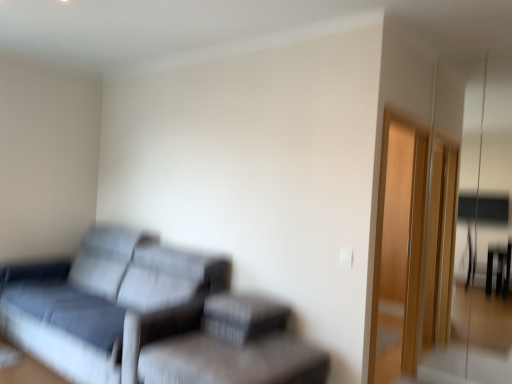
This screenshot has height=384, width=512. I want to click on textured gray swivel chair at lower center, so click(234, 348).

The image size is (512, 384). In order to click on textured fabric footrest at lower center in this screenshot , I will do `click(242, 317)`.

This screenshot has width=512, height=384. Find the location of `transparent glass door at right`. transparent glass door at right is located at coordinates (468, 356).

Which object is closer to the camera taking this photo, transparent glass door at right or textured gray couch at left?

textured gray couch at left is closer to the camera.

This screenshot has height=384, width=512. What are the coordinates of `studio couch below the transparent glass door at right (from the image's perspective)` in the screenshot? It's located at (150, 318).

In the scene shown: From the image's perspective, is transparent glass door at right located above textured gray couch at left?

Yes.

Is point (497, 281) farther from viewer compared to point (266, 356)?

Yes, point (497, 281) is behind point (266, 356).

Is textured fabric footrest at lower center bigger than textured gray couch at left?

No, textured fabric footrest at lower center is not bigger than textured gray couch at left.

How many degrees apart are the facing directions of textured fabric footrest at lower center and textured gray couch at left?

The facing directions of textured fabric footrest at lower center and textured gray couch at left are 0.457 degrees apart.

Which is behind, textured fabric footrest at lower center or textured gray couch at left?

textured fabric footrest at lower center is further from the camera.

Does textured fabric footrest at lower center turn towards textured gray couch at left?

No, textured fabric footrest at lower center is not aimed at textured gray couch at left.

Between textured fabric footrest at lower center and transparent glass door at right, which one appears on the right side from the viewer's perspective?

Positioned to the right is transparent glass door at right.

Image resolution: width=512 pixels, height=384 pixels. In order to click on footrest on the left side of transparent glass door at right in this screenshot , I will do `click(242, 317)`.

From a real-world perspective, which object stands above the other?

transparent glass door at right.

Does textured gray swivel chair at lower center turn towards textured fabric footrest at lower center?

No, textured gray swivel chair at lower center does not turn towards textured fabric footrest at lower center.

From the image's perspective, is textured gray swivel chair at lower center above or below textured fabric footrest at lower center?

textured gray swivel chair at lower center is below textured fabric footrest at lower center.

Who is smaller, textured gray swivel chair at lower center or textured fabric footrest at lower center?

With smaller size is textured fabric footrest at lower center.

Considering the positions of objects textured gray swivel chair at lower center and textured fabric footrest at lower center in the image provided, who is more to the left, textured gray swivel chair at lower center or textured fabric footrest at lower center?

From the viewer's perspective, textured gray swivel chair at lower center appears more on the left side.

Between transparent glass door at right and textured gray swivel chair at lower center, which one has larger width?

Wider between the two is textured gray swivel chair at lower center.

Consider the image. Considering the sizes of transparent glass door at right and textured gray swivel chair at lower center in the image, is transparent glass door at right bigger or smaller than textured gray swivel chair at lower center?

Considering their sizes, transparent glass door at right takes up more space than textured gray swivel chair at lower center.

Is textured gray swivel chair at lower center at the back of transparent glass door at right?

No, textured gray swivel chair at lower center is not at the back of transparent glass door at right.

From a real-world perspective, is transparent glass door at right physically below textured gray swivel chair at lower center?

No.

Is textured gray couch at left wider or thinner than transparent glass door at right?

In the image, textured gray couch at left appears to be wider than transparent glass door at right.

Could you tell me if textured gray couch at left is facing transparent glass door at right?

No, textured gray couch at left is not aimed at transparent glass door at right.

Considering the sizes of objects textured gray couch at left and transparent glass door at right in the image provided, who is smaller, textured gray couch at left or transparent glass door at right?

With smaller size is transparent glass door at right.

I want to click on glass door lying above the textured gray couch at left (from the image's perspective), so click(468, 356).

Is textured gray couch at left taller or shorter than textured fabric footrest at lower center?

In the image, textured gray couch at left appears to be taller than textured fabric footrest at lower center.

Is textured gray couch at left bigger or smaller than textured fabric footrest at lower center?

Considering their sizes, textured gray couch at left takes up more space than textured fabric footrest at lower center.

Is textured gray couch at left beside textured fabric footrest at lower center?

No, textured gray couch at left is not beside textured fabric footrest at lower center.

I want to click on the footrest lying behind the textured gray couch at left, so click(242, 317).

Locate an element on the screen. Image resolution: width=512 pixels, height=384 pixels. glass door located behind the textured gray couch at left is located at coordinates (468, 356).

You are a GUI agent. You are given a task and a screenshot of the screen. Output one action in this format:
    pyautogui.click(x=<x>, y=<y>)
    Task: Click on the studio couch on the left of the textured fabric footrest at lower center
    The width and height of the screenshot is (512, 384).
    Given the screenshot: What is the action you would take?
    pyautogui.click(x=150, y=318)

Estimate the real-world distances between objects in this image. Which object is closer to textured gray swivel chair at lower center, textured fabric footrest at lower center or textured gray couch at left?

Based on the image, textured fabric footrest at lower center appears to be nearer to textured gray swivel chair at lower center.

From the image, which object appears to be nearer to textured gray swivel chair at lower center, textured gray couch at left or textured fabric footrest at lower center?

Among the two, textured fabric footrest at lower center is located nearer to textured gray swivel chair at lower center.

Based on their spatial positions, is textured gray swivel chair at lower center or transparent glass door at right further from textured fabric footrest at lower center?

transparent glass door at right is further to textured fabric footrest at lower center.

Considering their positions, is textured gray couch at left positioned closer to textured fabric footrest at lower center than textured gray swivel chair at lower center?

textured gray swivel chair at lower center lies closer to textured fabric footrest at lower center than the other object.

Looking at the image, which one is located further to textured gray couch at left, textured gray swivel chair at lower center or transparent glass door at right?

transparent glass door at right is further to textured gray couch at left.

Which object lies nearer to the anchor point textured fabric footrest at lower center, transparent glass door at right or textured gray couch at left?

The object closer to textured fabric footrest at lower center is textured gray couch at left.

From the image, which object appears to be farther from textured gray swivel chair at lower center, textured gray couch at left or transparent glass door at right?

transparent glass door at right is further to textured gray swivel chair at lower center.

Consider the image. Based on their spatial positions, is transparent glass door at right or textured gray couch at left closer to textured gray swivel chair at lower center?

textured gray couch at left is closer to textured gray swivel chair at lower center.

You are a GUI agent. You are given a task and a screenshot of the screen. Output one action in this format:
    pyautogui.click(x=<x>, y=<y>)
    Task: Click on the swivel chair between textured gray couch at left and textured fabric footrest at lower center in the horizontal direction
    The width and height of the screenshot is (512, 384).
    Given the screenshot: What is the action you would take?
    pyautogui.click(x=234, y=348)

Locate an element on the screen. the footrest located between textured gray couch at left and transparent glass door at right in the left-right direction is located at coordinates (242, 317).

This screenshot has height=384, width=512. I want to click on the footrest situated between textured gray swivel chair at lower center and transparent glass door at right from left to right, so click(x=242, y=317).

Locate an element on the screen. Image resolution: width=512 pixels, height=384 pixels. swivel chair between textured gray couch at left and transparent glass door at right from left to right is located at coordinates (234, 348).